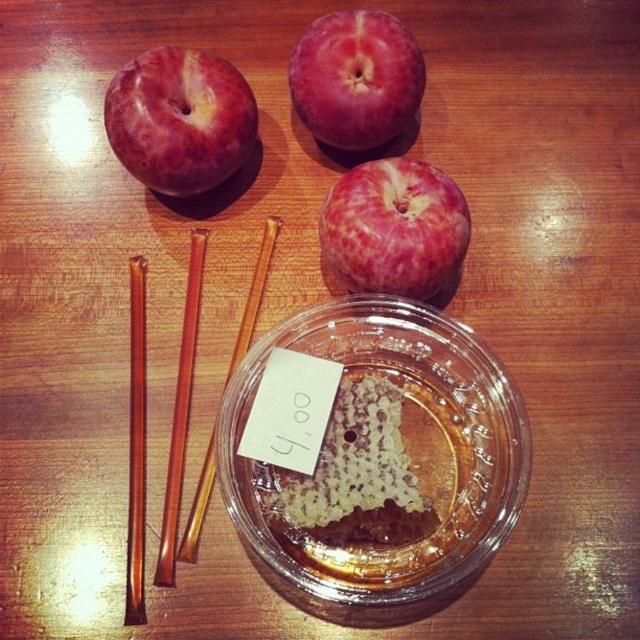
Question: Based on their relative distances, which object is farther from the translucent honeycomb at center?

Choices:
 (A) transparent glass bowl at center
 (B) translucent amber glass chopstick at upper center

Answer: (B)

Question: Estimate the real-world distances between objects in this image. Which object is closer to the brown wood chopstick at upper left?

Choices:
 (A) shiny red apple at upper center
 (B) brown translucent chopsticks at upper left
 (C) matte red apple at upper left
 (D) translucent amber glass chopstick at upper center

Answer: (B)

Question: Which object appears farthest from the camera in this image?

Choices:
 (A) translucent amber glass chopstick at upper center
 (B) pink matte apple at center

Answer: (A)

Question: Can you confirm if matte red apple at upper left is bigger than pink matte apple at center?

Choices:
 (A) yes
 (B) no

Answer: (A)

Question: Does matte red apple at upper left have a lesser width compared to translucent amber glass chopstick at upper center?

Choices:
 (A) no
 (B) yes

Answer: (A)

Question: From the image, what is the correct spatial relationship of matte red apple at upper left in relation to translucent amber glass chopstick at upper center?

Choices:
 (A) below
 (B) above

Answer: (B)